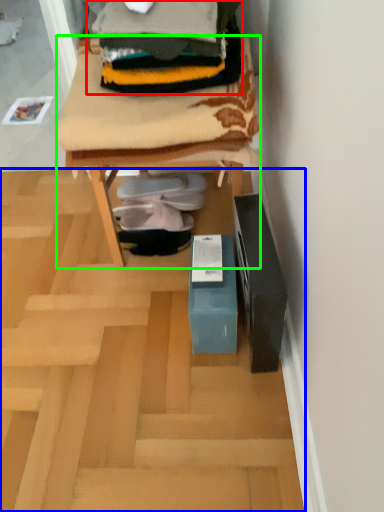
Question: Which object is positioned farthest from clothing (highlighted by a red box)? Select from furnurniture (highlighted by a blue box) and furniture (highlighted by a green box).

Choices:
 (A) furnurniture
 (B) furniture

Answer: (A)